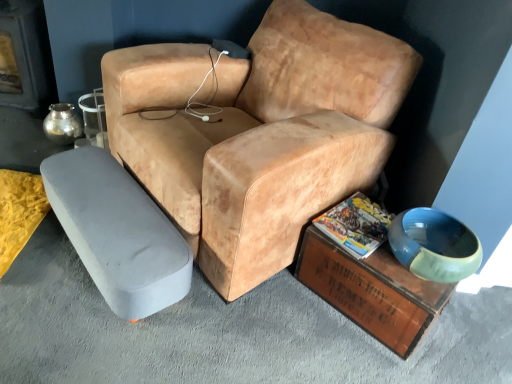
Question: Considering the relative positions of matte paper magazine at lower right and metallic silver fireplace at left in the image provided, is matte paper magazine at lower right to the right of metallic silver fireplace at left from the viewer's perspective?

Choices:
 (A) yes
 (B) no

Answer: (A)

Question: From the image's perspective, is matte paper magazine at lower right under metallic silver fireplace at left?

Choices:
 (A) yes
 (B) no

Answer: (A)

Question: From a real-world perspective, is matte paper magazine at lower right physically above metallic silver fireplace at left?

Choices:
 (A) no
 (B) yes

Answer: (A)

Question: From the image's perspective, does matte paper magazine at lower right appear higher than metallic silver fireplace at left?

Choices:
 (A) no
 (B) yes

Answer: (A)

Question: Would you consider matte paper magazine at lower right to be distant from metallic silver fireplace at left?

Choices:
 (A) yes
 (B) no

Answer: (A)

Question: Is metallic silver fireplace at left completely or partially inside matte paper magazine at lower right?

Choices:
 (A) yes
 (B) no

Answer: (B)

Question: From the image's perspective, is metallic silver fireplace at left beneath matte paper magazine at lower right?

Choices:
 (A) no
 (B) yes

Answer: (A)

Question: Is matte paper magazine at lower right located within metallic silver fireplace at left?

Choices:
 (A) no
 (B) yes

Answer: (A)

Question: Considering the relative sizes of metallic silver fireplace at left and matte paper magazine at lower right in the image provided, is metallic silver fireplace at left shorter than matte paper magazine at lower right?

Choices:
 (A) yes
 (B) no

Answer: (B)

Question: Is metallic silver fireplace at left further to the viewer compared to matte paper magazine at lower right?

Choices:
 (A) yes
 (B) no

Answer: (A)

Question: Is metallic silver fireplace at left looking in the opposite direction of matte paper magazine at lower right?

Choices:
 (A) yes
 (B) no

Answer: (B)

Question: Are metallic silver fireplace at left and matte paper magazine at lower right far apart?

Choices:
 (A) no
 (B) yes

Answer: (B)

Question: Is the depth of leather-like tan chair at center less than that of gray fabric ottoman at lower left, which is the 2th table in right-to-left order?

Choices:
 (A) yes
 (B) no

Answer: (A)